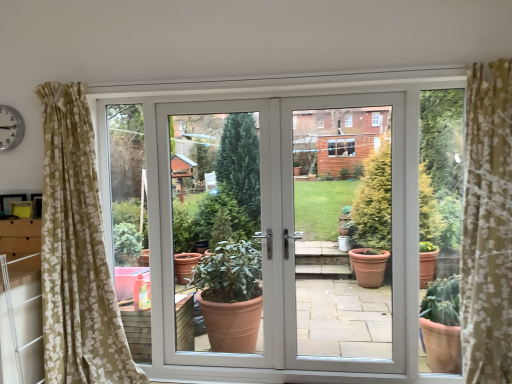
Question: Is white plastic clock at upper left outside of white plastic screen door at center?

Choices:
 (A) no
 (B) yes

Answer: (B)

Question: Is white plastic clock at upper left oriented towards white plastic screen door at center?

Choices:
 (A) no
 (B) yes

Answer: (A)

Question: Is white plastic clock at upper left looking in the opposite direction of white plastic screen door at center?

Choices:
 (A) no
 (B) yes

Answer: (A)

Question: Considering the relative positions of white plastic clock at upper left and white plastic screen door at center in the image provided, is white plastic clock at upper left to the right of white plastic screen door at center from the viewer's perspective?

Choices:
 (A) yes
 (B) no

Answer: (B)

Question: Is white plastic clock at upper left taller than white plastic screen door at center?

Choices:
 (A) no
 (B) yes

Answer: (A)

Question: Is white plastic clock at upper left wider than white plastic screen door at center?

Choices:
 (A) no
 (B) yes

Answer: (A)

Question: Does white plastic clock at upper left come in front of white glossy door at center?

Choices:
 (A) yes
 (B) no

Answer: (B)

Question: Can you confirm if white plastic clock at upper left is taller than white glossy door at center?

Choices:
 (A) no
 (B) yes

Answer: (A)

Question: Is white plastic clock at upper left to the left of white glossy door at center from the viewer's perspective?

Choices:
 (A) no
 (B) yes

Answer: (B)

Question: Is white plastic clock at upper left oriented away from white glossy door at center?

Choices:
 (A) yes
 (B) no

Answer: (B)

Question: Would you say white glossy door at center is part of white plastic clock at upper left's contents?

Choices:
 (A) yes
 (B) no

Answer: (B)

Question: From a real-world perspective, is white plastic clock at upper left over white glossy door at center?

Choices:
 (A) yes
 (B) no

Answer: (A)

Question: Does white plastic screen door at center lie in front of white glossy door at center?

Choices:
 (A) no
 (B) yes

Answer: (A)